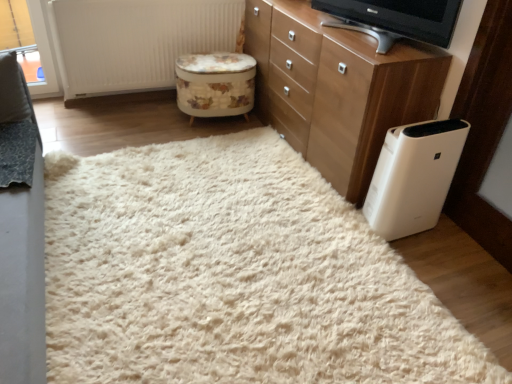
Locate an element on the screen. free space to the left of floral fabric ottoman at center is located at coordinates (151, 121).